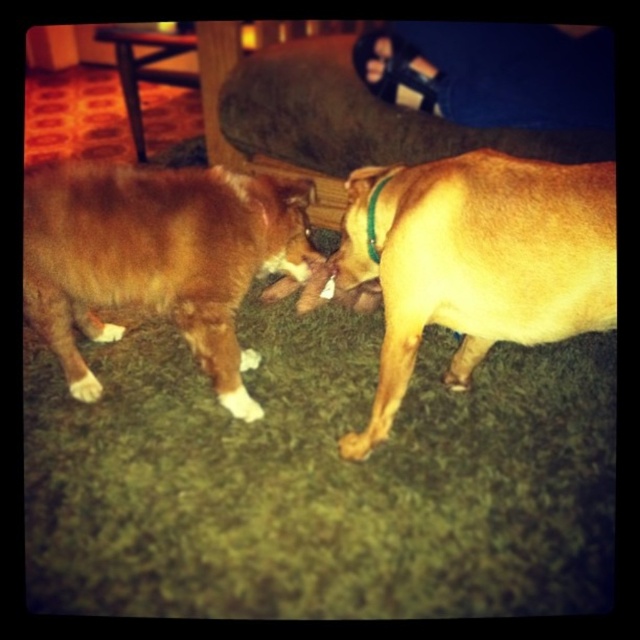
Question: Does leather sandal at upper center have a smaller size compared to green fabric neckband at center?

Choices:
 (A) yes
 (B) no

Answer: (B)

Question: Which of the following is the closest to the observer?

Choices:
 (A) golden smooth dog at right
 (B) leather sandal at upper center
 (C) green fabric neckband at center
 (D) brown furry dog at center

Answer: (A)

Question: Which is farther from the golden smooth dog at right?

Choices:
 (A) green fabric neckband at center
 (B) leather sandal at upper center
 (C) brown furry dog at center

Answer: (B)

Question: Is leather sandal at upper center thinner than brown fur paw at lower center?

Choices:
 (A) yes
 (B) no

Answer: (B)

Question: Is golden smooth dog at right further to camera compared to leather sandal at upper center?

Choices:
 (A) no
 (B) yes

Answer: (A)

Question: Which point is farther to the camera?

Choices:
 (A) (474, 310)
 (B) (372, 198)
 (C) (340, 449)

Answer: (B)